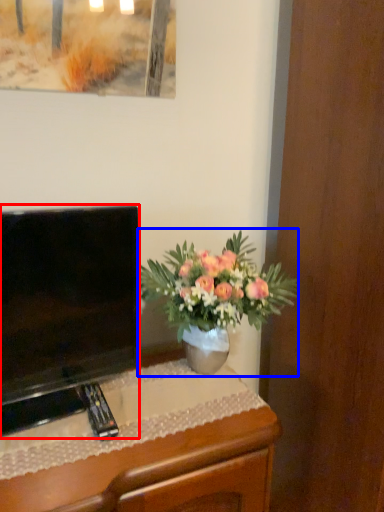
Question: Which object is further to the camera taking this photo, television (highlighted by a red box) or houseplant (highlighted by a blue box)?

Choices:
 (A) television
 (B) houseplant

Answer: (B)